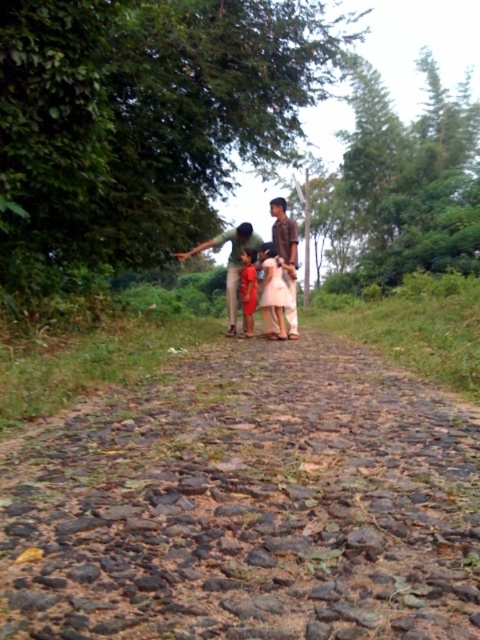
Does green matte shirt at center have a larger size compared to white satin dress at center?

Yes, green matte shirt at center is bigger than white satin dress at center.

Who is shorter, green matte shirt at center or white satin dress at center?

With less height is white satin dress at center.

Between point (252, 240) and point (274, 328), which one is positioned in front?

Point (274, 328)

I want to click on green matte shirt at center, so click(229, 262).

Who is shorter, white satin dress at center or matte red dress at center?

matte red dress at center is shorter.

Is white satin dress at center closer to the viewer compared to matte red dress at center?

Yes.

Describe the element at coordinates (274, 291) in the screenshot. I see `white satin dress at center` at that location.

I want to click on white satin dress at center, so click(274, 291).

Is point (230, 275) positioned behind point (242, 317)?

No, it is not.

Is green matte shirt at center below matte red dress at center?

No, green matte shirt at center is not below matte red dress at center.

Between point (205, 244) and point (249, 317), which one is positioned behind?

Positioned behind is point (205, 244).

This screenshot has width=480, height=640. What are the coordinates of `green matte shirt at center` in the screenshot? It's located at (229, 262).